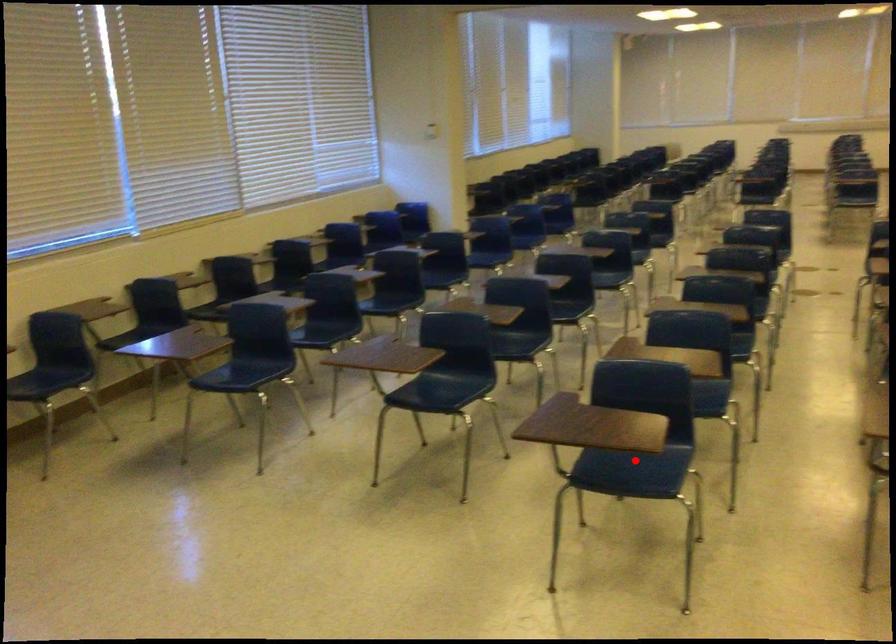
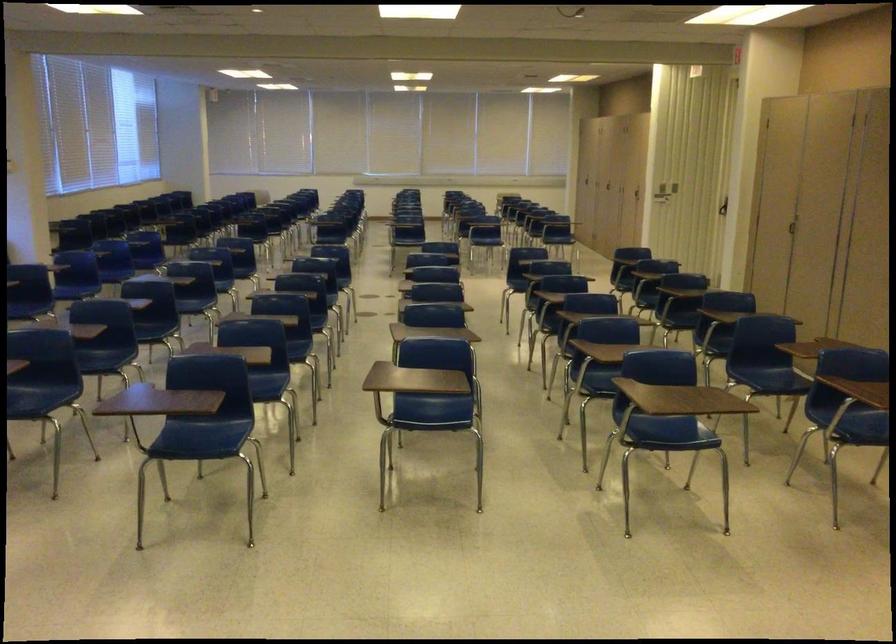
Where in the second image is the point corresponding to the highlighted location from the first image?

(203, 436)